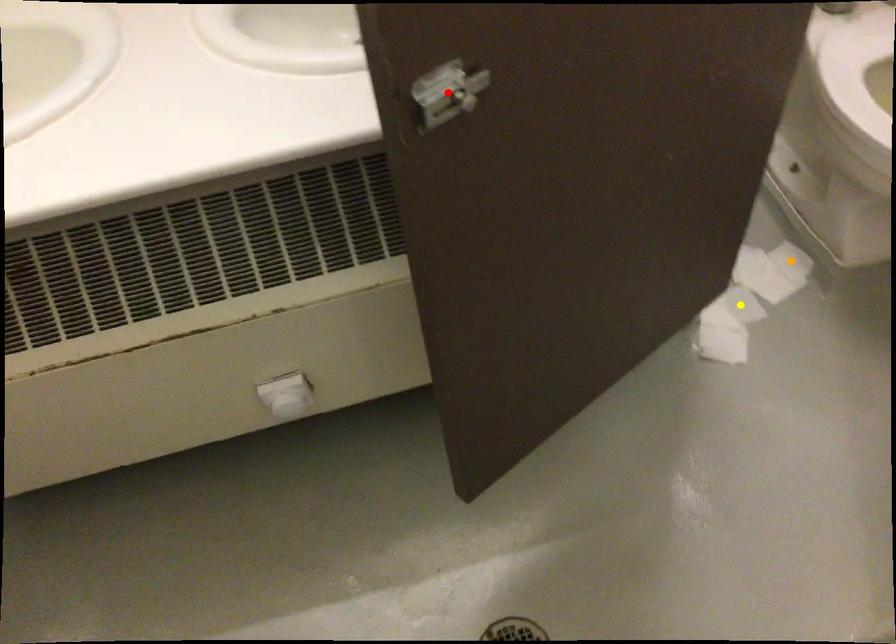
Order these from nearest to farthest:
orange point | red point | yellow point

red point
yellow point
orange point